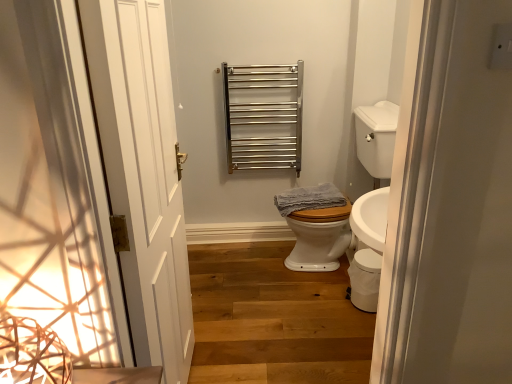
Find the location of a particular element. The image size is (512, 384). vacant space in front of white glossy sink at right is located at coordinates (314, 320).